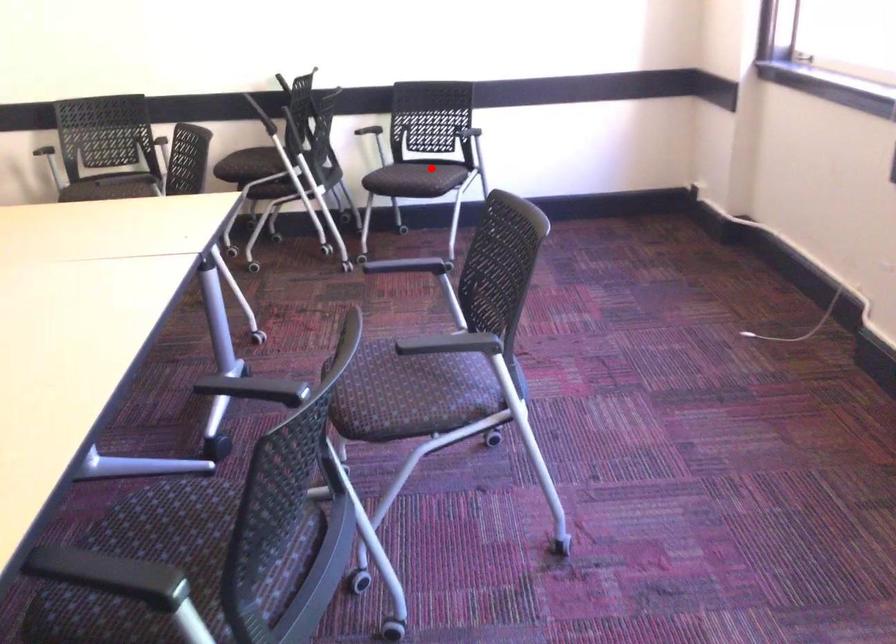
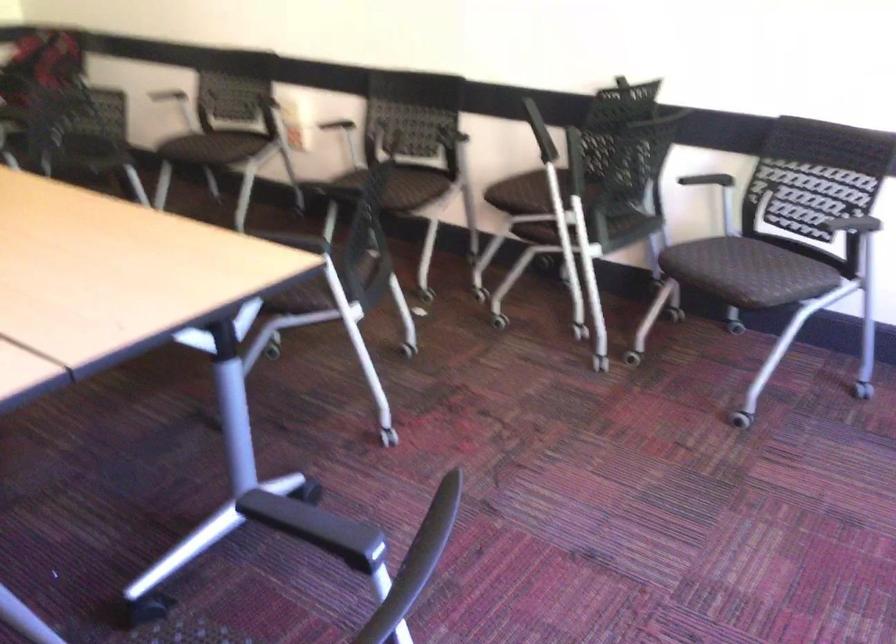
The point at the highlighted location is marked in the first image. Where is the corresponding point in the second image?

(764, 272)